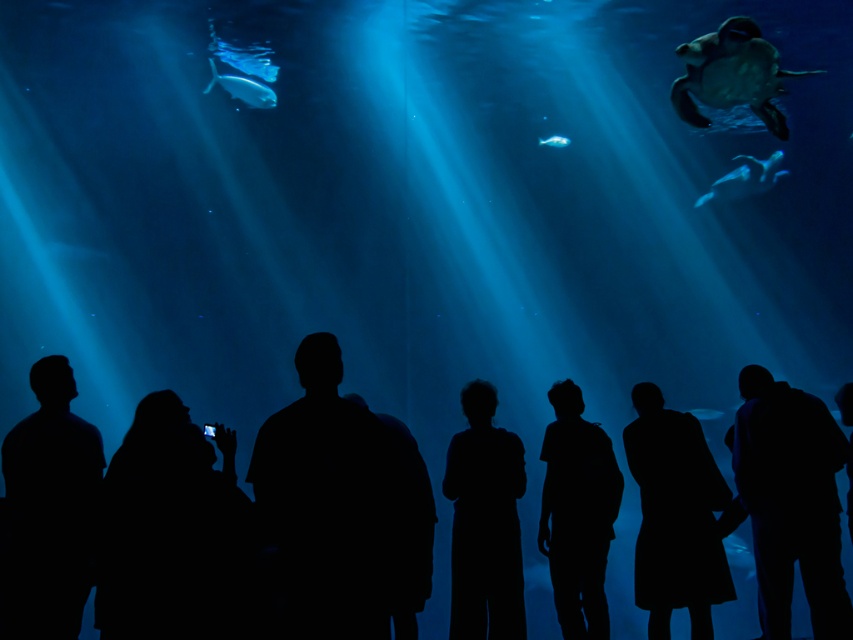
You are a visitor at the aquarium and you see the smooth green turtle at upper right and the translucent blue fish at upper center. Which one is taller?

The smooth green turtle at upper right is taller than the translucent blue fish at upper center.

You are standing in the aquarium and see two points marked in the scene. Which point, point (485, 484) or point (721, 22), is closer to you?

Point (485, 484) is closer to the viewer than point (721, 22).

You are standing in the aquarium and want to take a photo of the silhouette figure at center. Where should you position yourself to capture the figure in the center of your camera frame?

You should position yourself at point (485, 522) to capture the silhouette figure at center in the center of your camera frame.